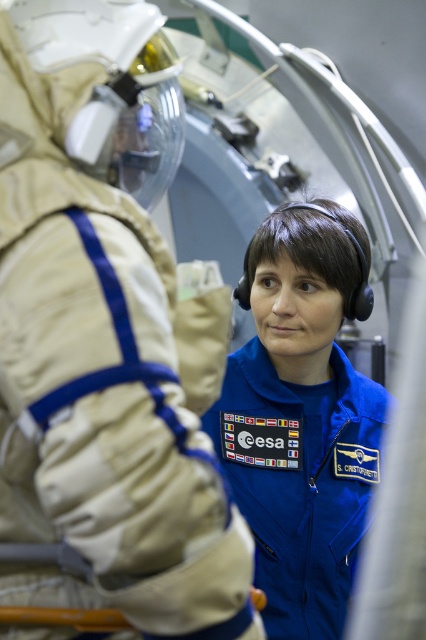
Question: Does beige fabric spacesuit at center have a greater width compared to blue fabric astronaut suit at center?

Choices:
 (A) no
 (B) yes

Answer: (A)

Question: Which of the following is the farthest from the observer?

Choices:
 (A) beige fabric spacesuit at center
 (B) blue fabric astronaut suit at center

Answer: (B)

Question: Can you confirm if beige fabric spacesuit at center is wider than blue fabric astronaut suit at center?

Choices:
 (A) yes
 (B) no

Answer: (B)

Question: Is beige fabric spacesuit at center bigger than blue fabric astronaut suit at center?

Choices:
 (A) yes
 (B) no

Answer: (A)

Question: Which point is farther to the camera?

Choices:
 (A) blue fabric astronaut suit at center
 (B) beige fabric spacesuit at center

Answer: (A)